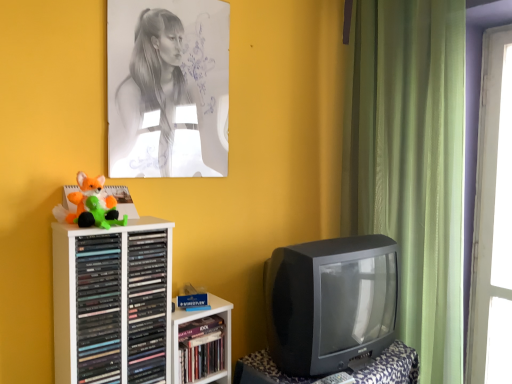
Question: Considering the relative positions of green plush toy at left, the 2th toy viewed from the top, and gray paper portrait at upper center in the image provided, is green plush toy at left, the 2th toy viewed from the top, to the left or to the right of gray paper portrait at upper center?

Choices:
 (A) left
 (B) right

Answer: (A)

Question: Is green plush toy at left, which ranks as the first toy in bottom-to-top order, taller or shorter than gray paper portrait at upper center?

Choices:
 (A) tall
 (B) short

Answer: (B)

Question: Estimate the real-world distances between objects in this image. Which object is closer to the fluffy orange fox at left, which is counted as the 1th toy, starting from the top?

Choices:
 (A) white plastic shelf at left
 (B) hardcover book at center, which ranks as the first book in right-to-left order
 (C) green fabric curtain at right
 (D) black matte cd case at left, placed as the 2th book when sorted from right to left
 (E) black plastic television at right

Answer: (A)

Question: Considering the real-world distances, which object is closest to the matte black books at left, which is the 3th book from right to left?

Choices:
 (A) black matte cd case at left, placed as the 2th book when sorted from left to right
 (B) hardcover book at center, which ranks as the first book in right-to-left order
 (C) black plastic television at lower right
 (D) white plastic shelf at left
 (E) green fabric curtain at right

Answer: (D)